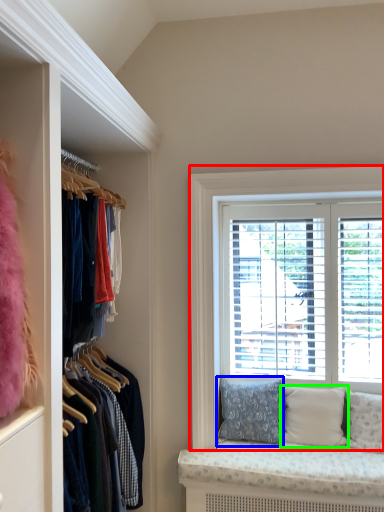
Question: Based on their relative distances, which object is nearer to window (highlighted by a red box)? Choose from pillow (highlighted by a blue box) and pillow (highlighted by a green box).

Choices:
 (A) pillow
 (B) pillow

Answer: (A)